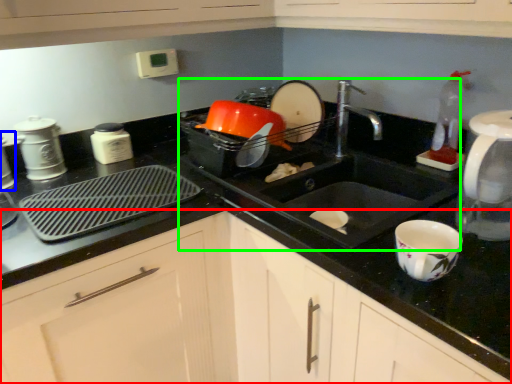
Question: Which object is positioned closest to cabinetry (highlighted by a red box)? Select from appliance (highlighted by a blue box) and sink (highlighted by a green box).

Choices:
 (A) appliance
 (B) sink

Answer: (B)